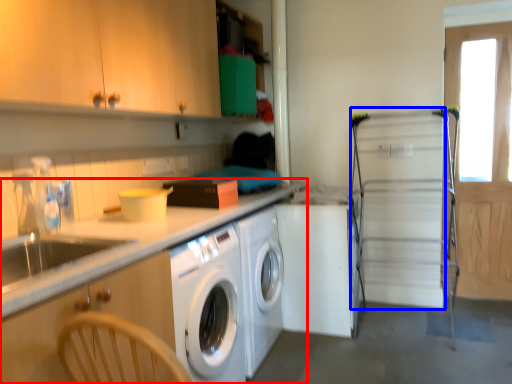
Question: Among these objects, which one is nearest to the camera, countertop (highlighted by a red box) or screen door (highlighted by a blue box)?

Choices:
 (A) countertop
 (B) screen door

Answer: (A)